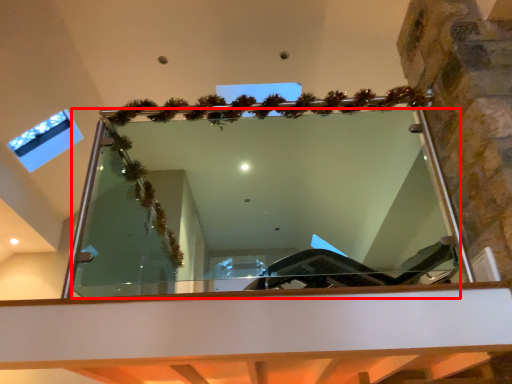
Question: In this image, where is mirror (annotated by the red box) located relative to window?

Choices:
 (A) left
 (B) right

Answer: (B)